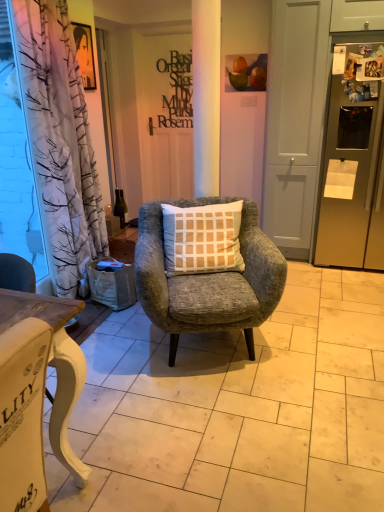
Question: From the image's perspective, is matte black sign at center located beneath transparent plastic curtain at left?

Choices:
 (A) no
 (B) yes

Answer: (A)

Question: Can we say matte black sign at center lies outside transparent plastic curtain at left?

Choices:
 (A) no
 (B) yes

Answer: (B)

Question: Is matte black sign at center oriented away from transparent plastic curtain at left?

Choices:
 (A) no
 (B) yes

Answer: (A)

Question: Can you confirm if matte black sign at center is smaller than transparent plastic curtain at left?

Choices:
 (A) yes
 (B) no

Answer: (A)

Question: Does matte black sign at center lie behind transparent plastic curtain at left?

Choices:
 (A) no
 (B) yes

Answer: (B)

Question: In terms of size, does matte gray chair at center appear bigger or smaller than white painted wood desk at lower left?

Choices:
 (A) small
 (B) big

Answer: (B)

Question: Considering the positions of matte gray chair at center and white painted wood desk at lower left in the image, is matte gray chair at center wider or thinner than white painted wood desk at lower left?

Choices:
 (A) wide
 (B) thin

Answer: (A)

Question: From the image's perspective, is matte gray chair at center located above or below white painted wood desk at lower left?

Choices:
 (A) above
 (B) below

Answer: (A)

Question: Is point (276, 388) closer or farther from the camera than point (6, 288)?

Choices:
 (A) closer
 (B) farther

Answer: (B)

Question: Relative to green glass bottle at center, is matte black sign at center in front or behind?

Choices:
 (A) front
 (B) behind

Answer: (B)

Question: From the image's perspective, is matte black sign at center located above or below green glass bottle at center?

Choices:
 (A) above
 (B) below

Answer: (A)

Question: Looking at their shapes, would you say matte black sign at center is wider or thinner than green glass bottle at center?

Choices:
 (A) thin
 (B) wide

Answer: (A)

Question: Considering the positions of point (185, 56) and point (120, 212), is point (185, 56) closer or farther from the camera than point (120, 212)?

Choices:
 (A) closer
 (B) farther

Answer: (B)

Question: Looking at their shapes, would you say white matte screen door at center is wider or thinner than white painted wood desk at lower left?

Choices:
 (A) thin
 (B) wide

Answer: (B)

Question: Is point (317, 123) positioned closer to the camera than point (59, 313)?

Choices:
 (A) closer
 (B) farther

Answer: (B)